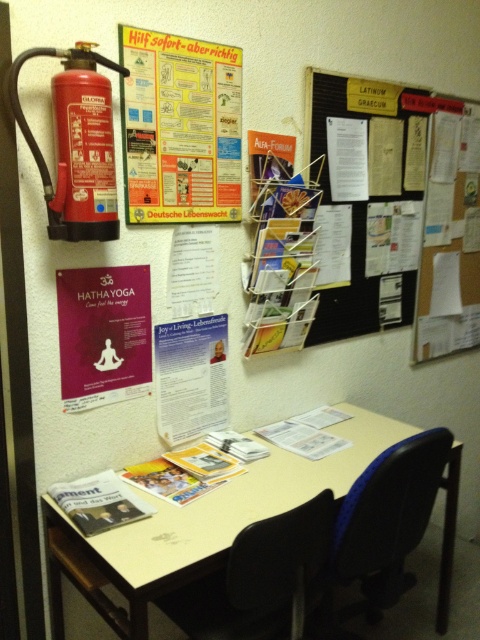
Does black plastic swivel chair at lower center have a lesser width compared to red matte fire extinguisher at upper left?

No, black plastic swivel chair at lower center is not thinner than red matte fire extinguisher at upper left.

Does black plastic swivel chair at lower center appear under red matte fire extinguisher at upper left?

Indeed, black plastic swivel chair at lower center is positioned under red matte fire extinguisher at upper left.

Find the location of a particular element. This screenshot has width=480, height=640. black plastic swivel chair at lower center is located at coordinates (259, 577).

In order to click on black plastic swivel chair at lower center in this screenshot , I will do `click(259, 577)`.

Is point (285, 464) positioned before point (91, 218)?

No, it is not.

Which is behind, point (200, 515) or point (112, 218)?

The point (200, 515) is more distant.

Which is in front, point (222, 541) or point (96, 99)?

Point (222, 541)

Identify the location of white plastic table at center. The height and width of the screenshot is (640, 480). point(223,515).

What do you see at coordinates (180, 128) in the screenshot? The image size is (480, 640). I see `orange paper poster at upper center` at bounding box center [180, 128].

Which is in front, point (169, 120) or point (348, 552)?

Positioned in front is point (348, 552).

The width and height of the screenshot is (480, 640). Find the location of `orange paper poster at upper center`. orange paper poster at upper center is located at coordinates (180, 128).